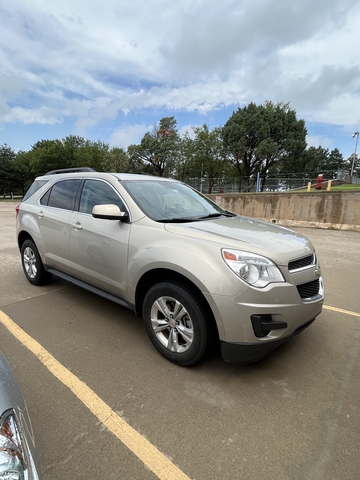
Find the location of a particular element. This screenshot has height=480, width=360. front door is located at coordinates (82, 234).